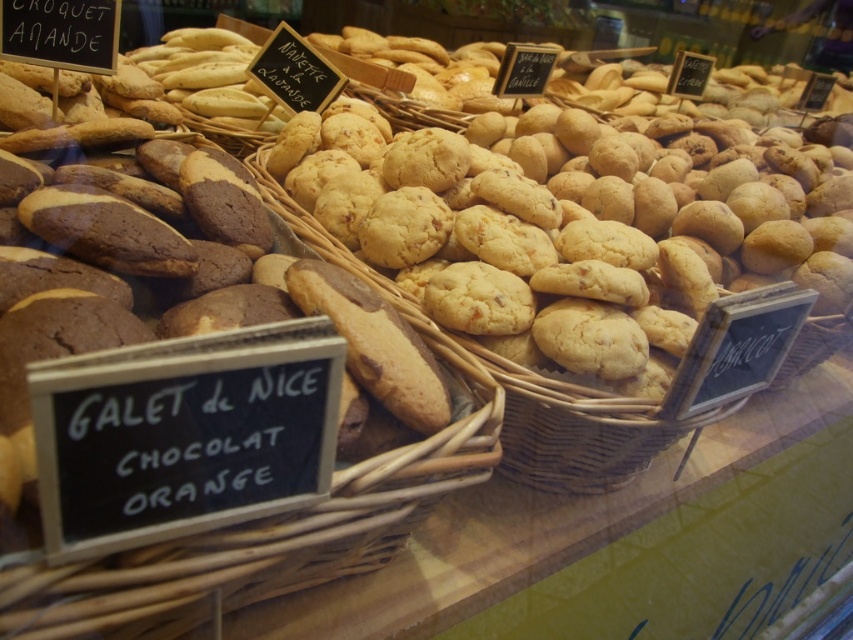
Question: Which point is closer to the camera?

Choices:
 (A) (573, 483)
 (B) (231, 593)

Answer: (B)

Question: Which of the following is the farthest from the observer?

Choices:
 (A) (497, 422)
 (B) (426, 131)

Answer: (B)

Question: Considering the relative positions of golden-brown wicker basket at center and brown wicker basket at center in the image provided, where is golden-brown wicker basket at center located with respect to brown wicker basket at center?

Choices:
 (A) right
 (B) left

Answer: (A)

Question: Which of the following is the closest to the observer?

Choices:
 (A) brown wicker basket at center
 (B) golden-brown wicker basket at center

Answer: (A)

Question: Considering the relative positions of golden-brown wicker basket at center and brown wicker basket at center in the image provided, where is golden-brown wicker basket at center located with respect to brown wicker basket at center?

Choices:
 (A) left
 (B) right

Answer: (B)

Question: Does golden-brown wicker basket at center have a smaller size compared to brown wicker basket at center?

Choices:
 (A) no
 (B) yes

Answer: (A)